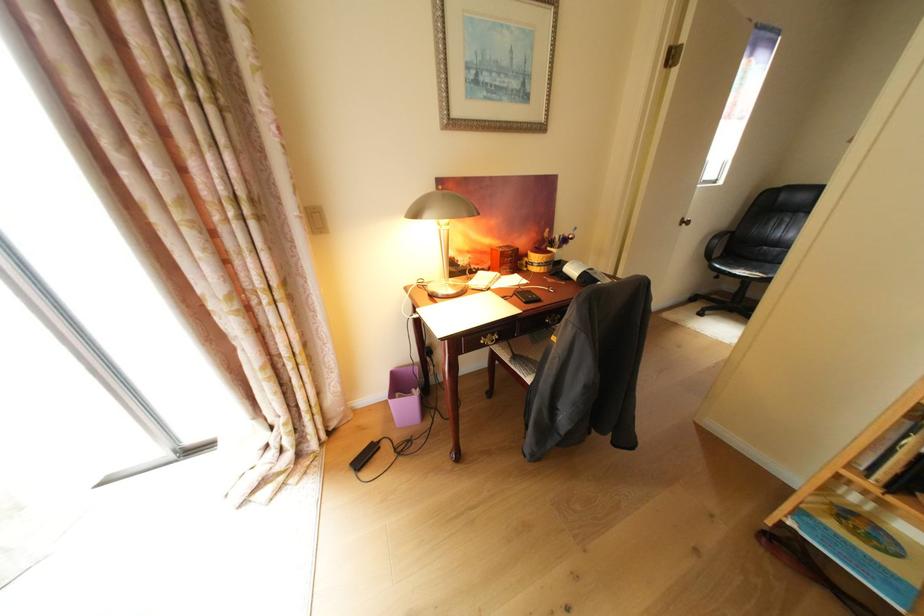
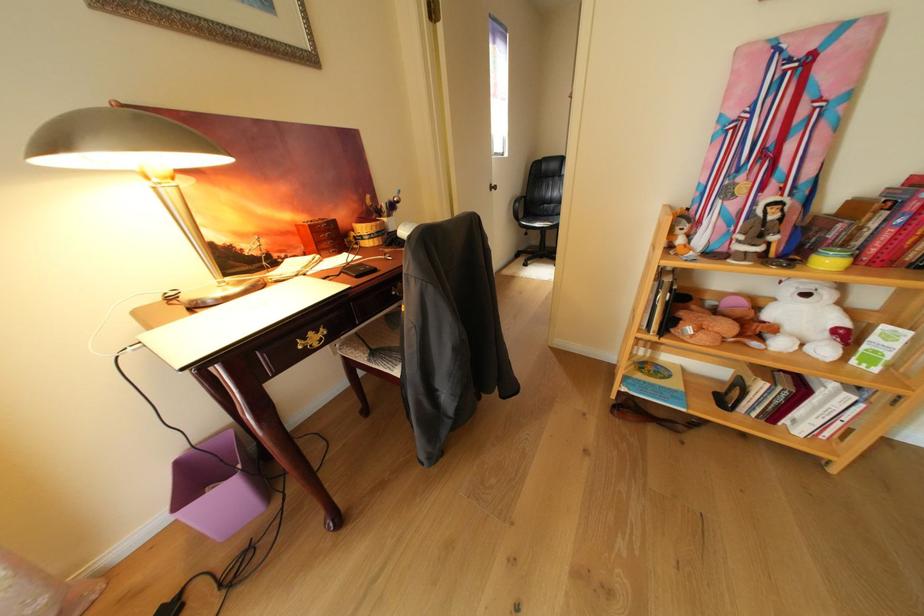
In the second image, find the point that corresponds to (x=805, y=525) in the first image.

(638, 391)